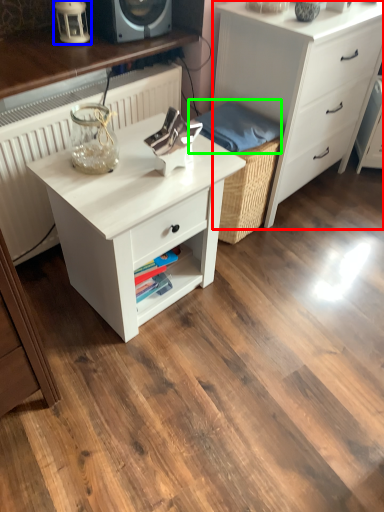
Question: Which is nearer to the chest of drawers (highlighted by a red box)? table lamp (highlighted by a blue box) or material (highlighted by a green box).

Choices:
 (A) table lamp
 (B) material

Answer: (B)